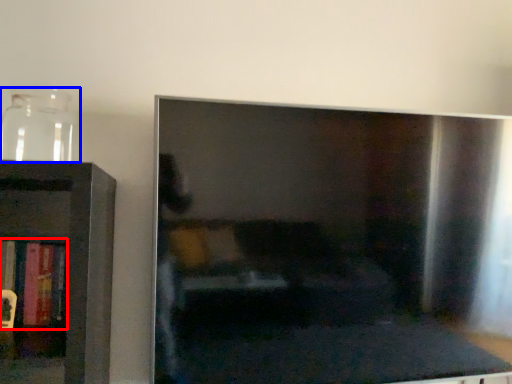
Question: Which point is closer to the camera, book (highlighted by a red box) or glass vase (highlighted by a blue box)?

Choices:
 (A) book
 (B) glass vase

Answer: (B)